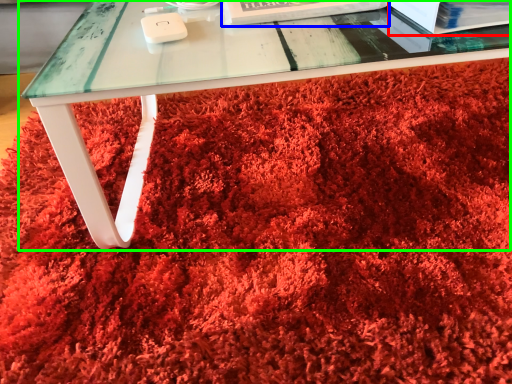
Question: Estimate the real-world distances between objects in this image. Which object is closer to paperback book (highlighted by a red box), paperback book (highlighted by a blue box) or table (highlighted by a green box)?

Choices:
 (A) paperback book
 (B) table

Answer: (A)